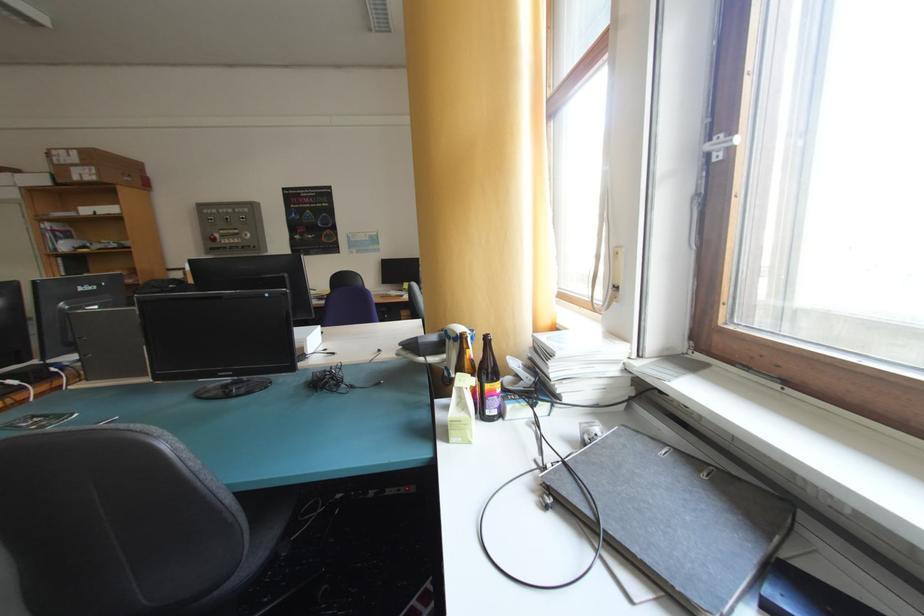
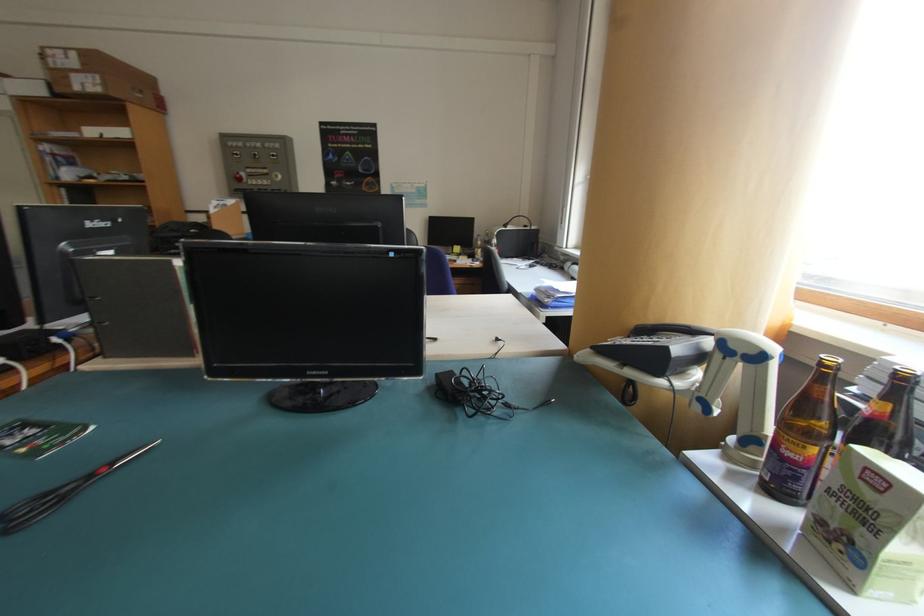
What movement of the cameraman would produce the second image?

The cameraman walked toward left, forward.